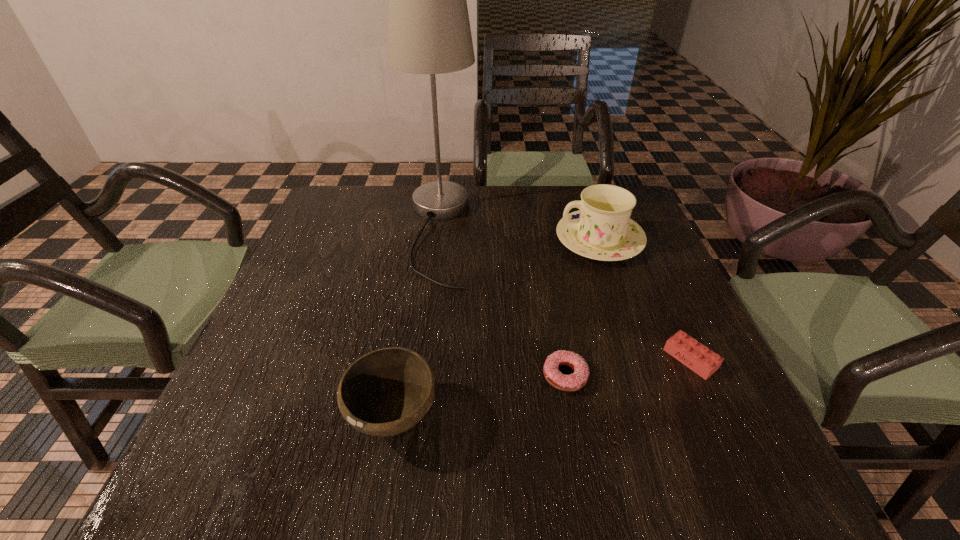
Identify the location of vacant space positioned 0.220m on the left of the Lego. The image size is (960, 540). (554, 359).

Find the location of a particular element. The image size is (960, 540). free location located on the back of the doughnut is located at coordinates (540, 237).

You are a GUI agent. You are given a task and a screenshot of the screen. Output one action in this format:
    pyautogui.click(x=<x>, y=<y>)
    Task: Click on the table lamp located in the far edge section of the desktop
    
    Given the screenshot: What is the action you would take?
    pyautogui.click(x=429, y=32)

The width and height of the screenshot is (960, 540). What are the coordinates of `chinaware situated at the far edge` in the screenshot? It's located at (602, 229).

Identify the location of object located at the near edge. The height and width of the screenshot is (540, 960). (386, 392).

Where is `chinaware present at the right edge`? The height and width of the screenshot is (540, 960). chinaware present at the right edge is located at coordinates (602, 229).

You are a GUI agent. You are given a task and a screenshot of the screen. Output one action in this format:
    pyautogui.click(x=<x>, y=<y>)
    Task: Click on the Lego situated at the right edge
    
    Given the screenshot: What is the action you would take?
    pyautogui.click(x=697, y=357)

Identify the location of object at the far right corner. This screenshot has width=960, height=540. (602, 229).

Where is `vacant area at the far edge of the desktop`? vacant area at the far edge of the desktop is located at coordinates tap(380, 211).

In the image, there is a desktop. Find the location of `vacant space at the near edge`. vacant space at the near edge is located at coordinates (620, 470).